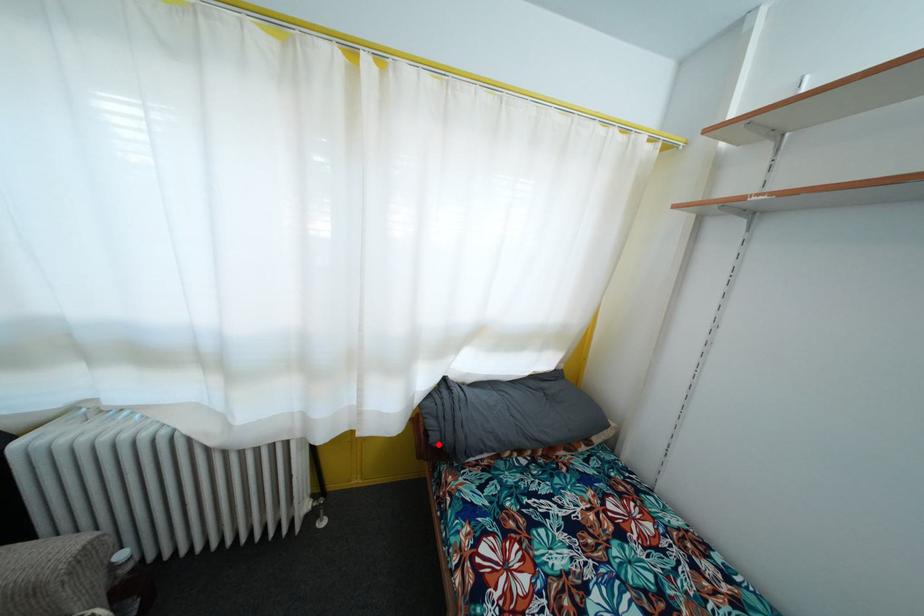
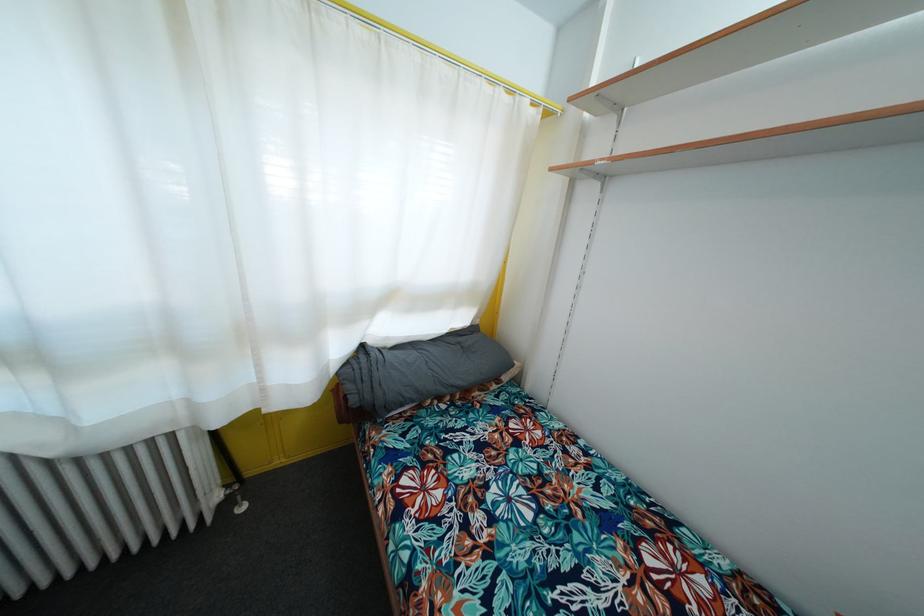
Find the pixel in the second image that matches the highlighted location in the first image.

(358, 407)